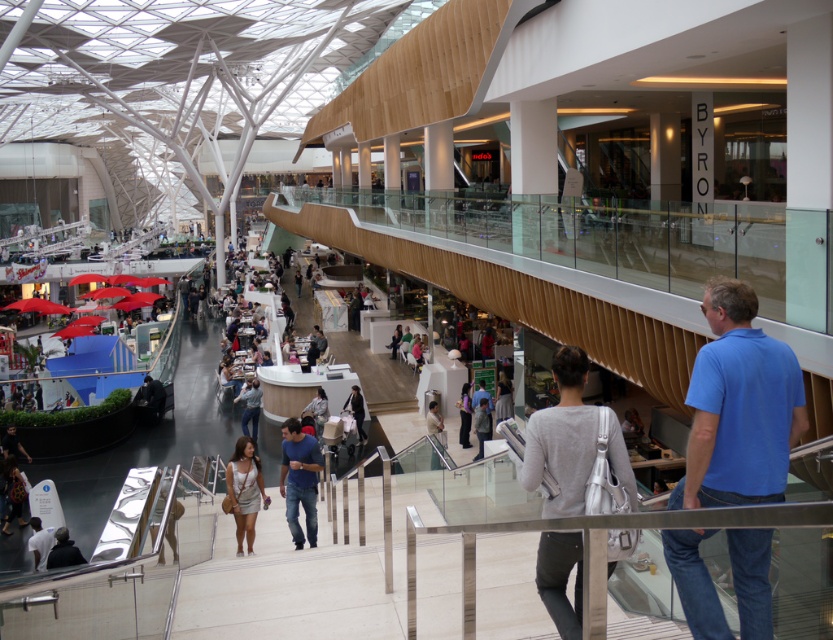
Does blue cotton shirt at right have a larger size compared to black leather jacket at center?

Correct, blue cotton shirt at right is larger in size than black leather jacket at center.

Find the location of a particular element. The width and height of the screenshot is (833, 640). blue cotton shirt at right is located at coordinates (739, 406).

At what (x,y) coordinates should I click in order to perform the action: click on blue cotton shirt at right. Please return your answer as a coordinate pair (x, y). The height and width of the screenshot is (640, 833). Looking at the image, I should click on (739, 406).

Is blue cotton shirt at right further to the viewer compared to white fabric at lower left?

No, blue cotton shirt at right is in front of white fabric at lower left.

Which is below, blue cotton shirt at right or white fabric at lower left?

white fabric at lower left is lower down.

Is point (761, 573) positioned after point (47, 540)?

No, (761, 573) is in front of (47, 540).

Where is `blue cotton shirt at right`? This screenshot has height=640, width=833. blue cotton shirt at right is located at coordinates (739, 406).

Is blue cotton shirt at right below denim jeans at center?

Incorrect, blue cotton shirt at right is not positioned below denim jeans at center.

Which of these two, blue cotton shirt at right or denim jeans at center, stands taller?

With more height is blue cotton shirt at right.

Which is in front, point (702, 352) or point (252, 426)?

Point (702, 352) is more forward.

This screenshot has width=833, height=640. Identify the location of blue cotton shirt at right. (739, 406).